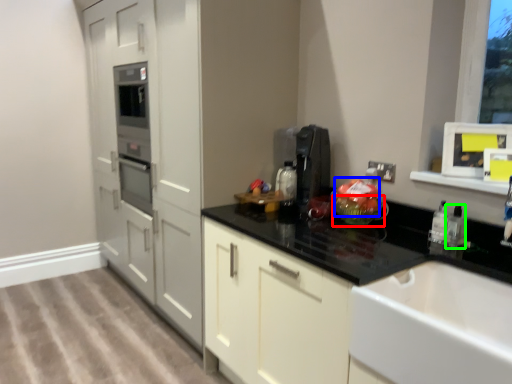
Question: Which object is the farthest from glass bowl (highlighted by a red box)? Choose among these: food (highlighted by a blue box) or bottle (highlighted by a green box).

Choices:
 (A) food
 (B) bottle

Answer: (B)